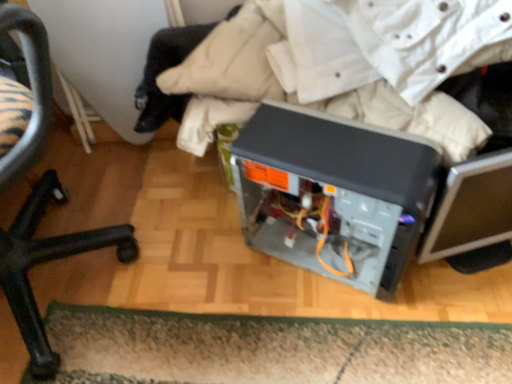
Question: From the image's perspective, does satin black computer case at center appear higher than green shaggy doormat at lower center?

Choices:
 (A) yes
 (B) no

Answer: (A)

Question: Is green shaggy doormat at lower center completely or partially inside satin black computer case at center?

Choices:
 (A) yes
 (B) no

Answer: (B)

Question: From a real-world perspective, is satin black computer case at center on top of green shaggy doormat at lower center?

Choices:
 (A) yes
 (B) no

Answer: (A)

Question: Does satin black computer case at center appear on the right side of green shaggy doormat at lower center?

Choices:
 (A) yes
 (B) no

Answer: (A)

Question: Does satin black computer case at center have a smaller size compared to green shaggy doormat at lower center?

Choices:
 (A) no
 (B) yes

Answer: (A)

Question: Is satin black computer case at center taller than green shaggy doormat at lower center?

Choices:
 (A) yes
 (B) no

Answer: (A)

Question: Does green shaggy doormat at lower center have a larger size compared to black plastic chair at lower left?

Choices:
 (A) yes
 (B) no

Answer: (B)

Question: From a real-world perspective, is green shaggy doormat at lower center beneath black plastic chair at lower left?

Choices:
 (A) no
 (B) yes

Answer: (B)

Question: Is green shaggy doormat at lower center smaller than black plastic chair at lower left?

Choices:
 (A) no
 (B) yes

Answer: (B)

Question: Considering the relative sizes of green shaggy doormat at lower center and black plastic chair at lower left in the image provided, is green shaggy doormat at lower center shorter than black plastic chair at lower left?

Choices:
 (A) yes
 (B) no

Answer: (A)

Question: Is green shaggy doormat at lower center far from black plastic chair at lower left?

Choices:
 (A) yes
 (B) no

Answer: (B)

Question: Does green shaggy doormat at lower center lie behind black plastic chair at lower left?

Choices:
 (A) yes
 (B) no

Answer: (A)

Question: Can you confirm if black plastic chair at lower left is positioned to the left of green shaggy doormat at lower center?

Choices:
 (A) no
 (B) yes

Answer: (B)